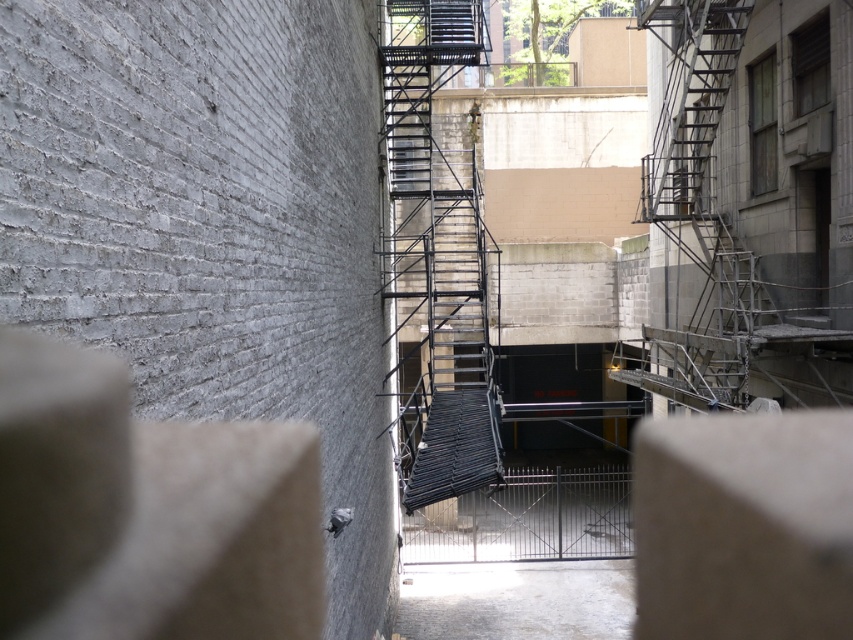
Does black metal fire escape at center have a greater width compared to metallic black staircase at center?

Yes.

Which of these two, black metal fire escape at center or metallic black staircase at center, stands shorter?

metallic black staircase at center

What do you see at coordinates (436, 257) in the screenshot?
I see `black metal fire escape at center` at bounding box center [436, 257].

Identify the location of black metal fire escape at center. (436, 257).

Consider the image. Is black metal fire escape at center closer to camera compared to metallic gray fire escape at center?

That is True.

Which is in front, point (404, 157) or point (683, 88)?

Point (683, 88)

What do you see at coordinates (436, 257) in the screenshot? I see `black metal fire escape at center` at bounding box center [436, 257].

What are the coordinates of `black metal fire escape at center` in the screenshot? It's located at (436, 257).

Is metallic gray fire escape at center positioned in front of metallic black staircase at center?

No.

This screenshot has height=640, width=853. What do you see at coordinates (697, 208) in the screenshot? I see `metallic gray fire escape at center` at bounding box center [697, 208].

Who is more distant from viewer, (697, 355) or (436, 483)?

The point (697, 355) is behind.

Locate an element on the screen. Image resolution: width=853 pixels, height=640 pixels. metallic gray fire escape at center is located at coordinates (697, 208).